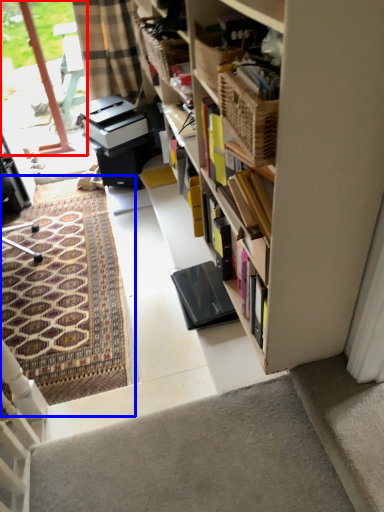
Question: Which point is closer to the camera, glass door (highlighted by a red box) or doormat (highlighted by a blue box)?

Choices:
 (A) glass door
 (B) doormat

Answer: (B)